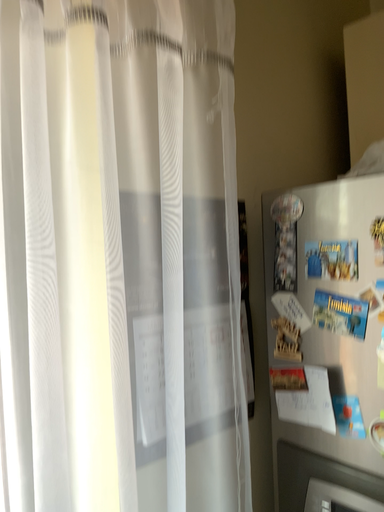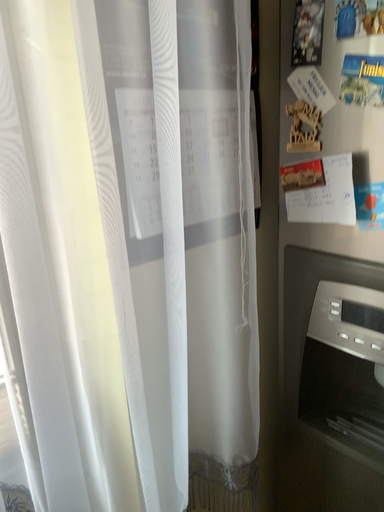
Question: How did the camera likely rotate when shooting the video?

Choices:
 (A) rotated upward
 (B) rotated downward

Answer: (B)